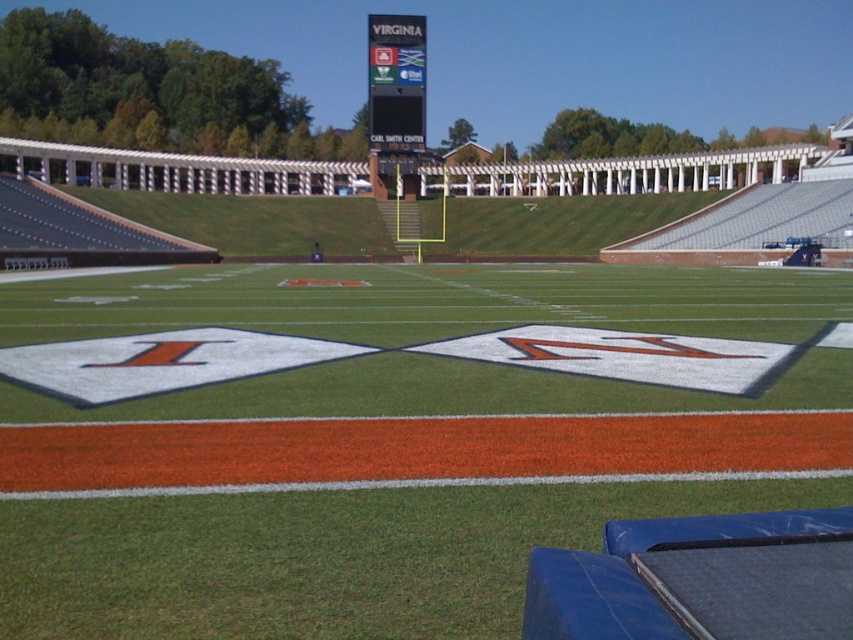
Question: Is green artificial turf at center bigger than black digital scoreboard at upper center?

Choices:
 (A) no
 (B) yes

Answer: (A)

Question: In this image, where is green artificial turf at center located relative to black digital scoreboard at upper center?

Choices:
 (A) above
 (B) below

Answer: (B)

Question: Which of the following is the closest to the observer?

Choices:
 (A) (373, 90)
 (B) (384, 444)

Answer: (B)

Question: Which point is closer to the camera taking this photo?

Choices:
 (A) (393, 592)
 (B) (418, 104)

Answer: (A)

Question: Which point is farther from the camera taking this photo?

Choices:
 (A) (7, 480)
 (B) (398, 76)

Answer: (B)

Question: Is green artificial turf at center below black digital scoreboard at upper center?

Choices:
 (A) no
 (B) yes

Answer: (B)